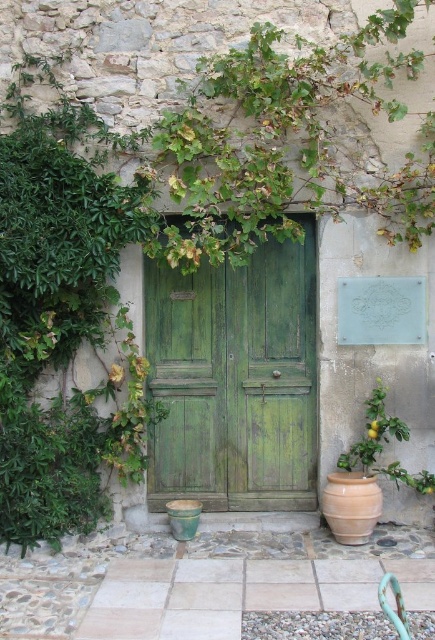
You are standing at the entrance of the building and need to locate the green matte plant at lower right. Which direction should you turn to face it from the green wooden door at center?

The green wooden door at center is to the left of the green matte plant at lower right, so you should turn to your right to face the green matte plant at lower right.

You are standing in front of the entrance to the traditional stone building. You need to locate the green wooden door at center. Based on its 2D coordinates, where exactly is it positioned in the image?

The green wooden door at center is positioned at the 2D coordinates point (234,380) in the image.

You are an interior designer planning to place a decorative item next to the green wooden door at center and the green matte plant at lower right. Considering their sizes, which object should you place the item closer to?

The green wooden door at center has a larger width than the green matte plant at lower right, so the decorative item should be placed closer to the green matte plant at lower right to maintain balance.